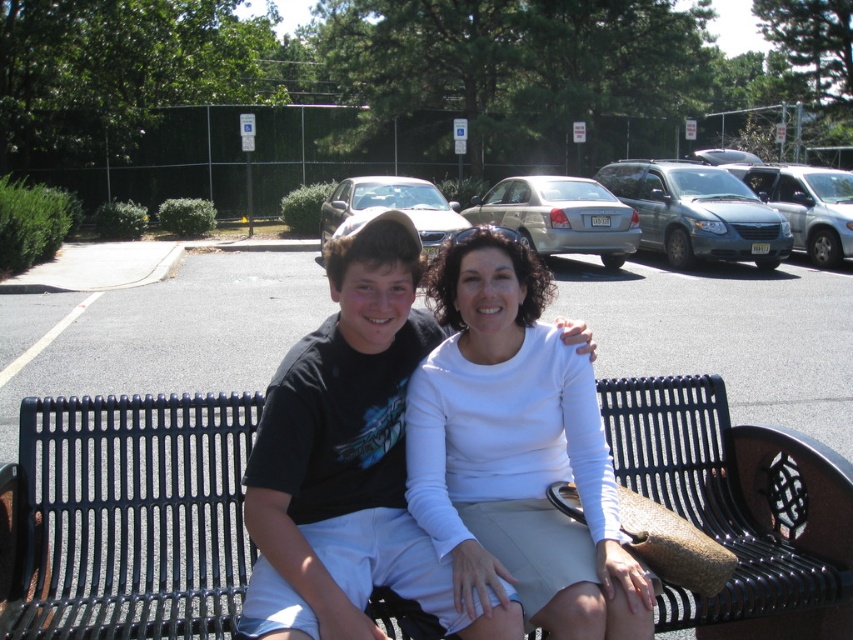
Between black metal bench at center and white matte shirt at center, which one has less height?

Standing shorter between the two is black metal bench at center.

I want to click on black metal bench at center, so click(131, 515).